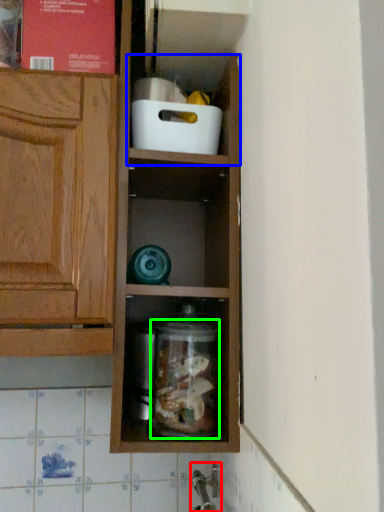
Question: Considering the real-world distances, which object is farthest from faucet (highlighted by a red box)? cabinet (highlighted by a blue box) or glass jar (highlighted by a green box)?

Choices:
 (A) cabinet
 (B) glass jar

Answer: (A)